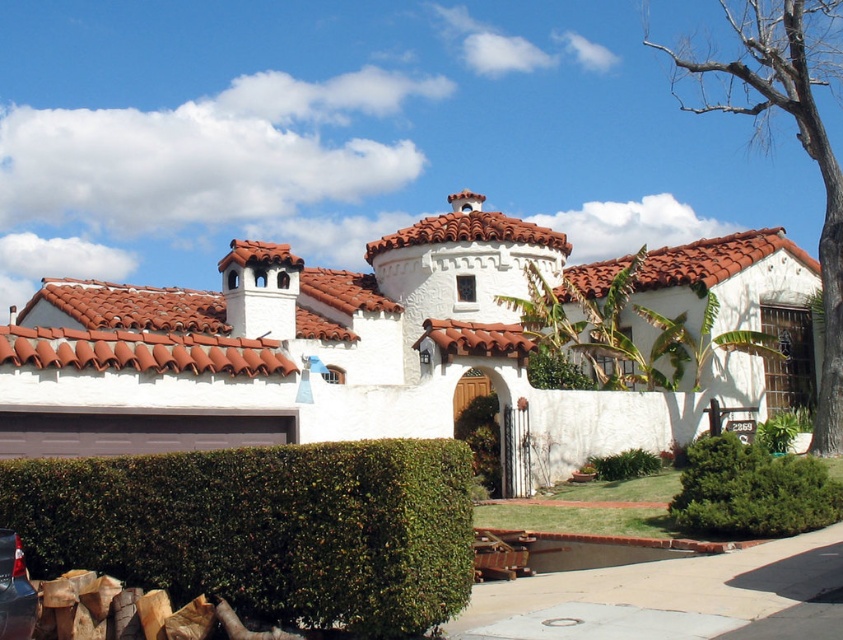
Can you confirm if green leafy plant at center is smaller than green leafy bush at center?

Actually, green leafy plant at center might be larger than green leafy bush at center.

Is green leafy plant at center below green leafy bush at center?

No.

Is point (753, 340) positioned after point (529, 353)?

That is True.

Identify the location of green leafy plant at center. The width and height of the screenshot is (843, 640). (627, 332).

Is green leafy bush at lower right bigger than green leafy bush at center?

Yes, green leafy bush at lower right is bigger than green leafy bush at center.

Is the position of green leafy bush at lower right less distant than that of green leafy bush at center?

That is True.

Does point (765, 488) lie behind point (576, 387)?

No, (765, 488) is closer to viewer.

The image size is (843, 640). In order to click on green leafy bush at lower right in this screenshot , I will do `click(752, 492)`.

Which is above, green leafy hedge at lower left or terracotta tiles at center?

Positioned higher is terracotta tiles at center.

Is green leafy hedge at lower left shorter than terracotta tiles at center?

Indeed, green leafy hedge at lower left has a lesser height compared to terracotta tiles at center.

Describe the element at coordinates (264, 528) in the screenshot. I see `green leafy hedge at lower left` at that location.

Identify the location of green leafy hedge at lower left. Image resolution: width=843 pixels, height=640 pixels. (264, 528).